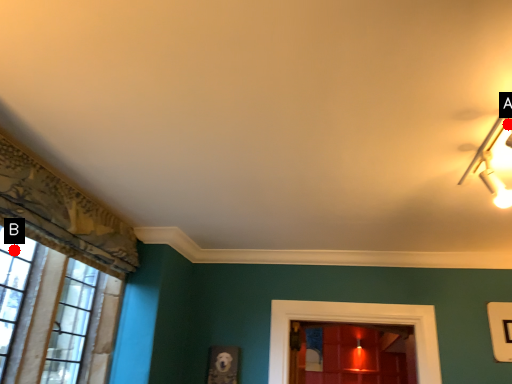
Question: Two points are circled on the image, labeled by A and B beside each circle. Which point appears closest to the camera in this image?

Choices:
 (A) A is closer
 (B) B is closer

Answer: (A)